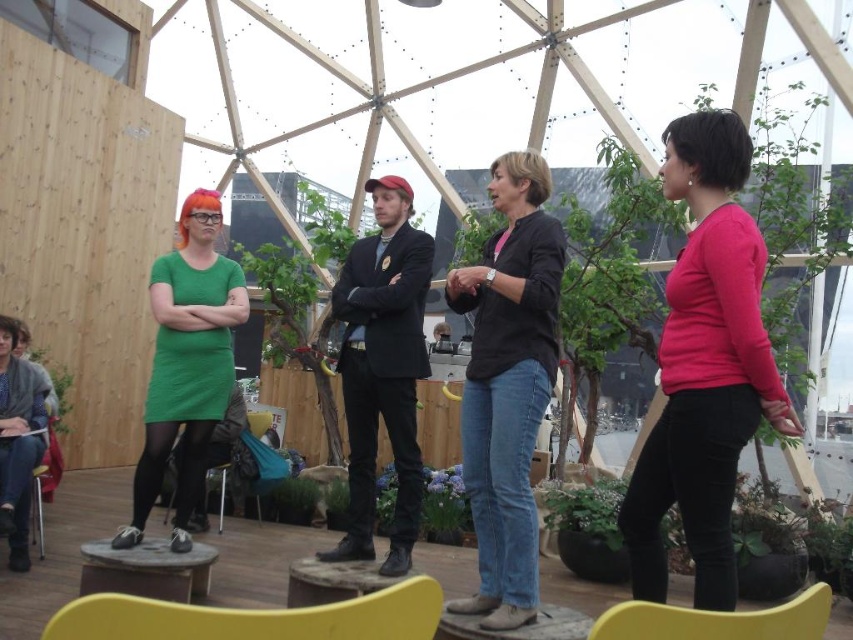
Question: Can you confirm if denim jeans at center is positioned to the left of yellow plastic chair at lower center?

Choices:
 (A) no
 (B) yes

Answer: (A)

Question: Which of the following is the closest to the observer?

Choices:
 (A) green matte dress at center
 (B) green fabric dress at lower left
 (C) black suit at center

Answer: (A)

Question: Can you confirm if matte yellow chair at lower center is positioned above green fabric dress at lower left?

Choices:
 (A) yes
 (B) no

Answer: (B)

Question: Is matte pink sweater at right wider than green matte plant at lower left?

Choices:
 (A) yes
 (B) no

Answer: (A)

Question: Considering the real-world distances, which object is farthest from the black suit at center?

Choices:
 (A) green matte plant at lower left
 (B) matte yellow chair at lower center
 (C) purple matte plant at center
 (D) green matte dress at center

Answer: (B)

Question: Which object appears farthest from the camera in this image?

Choices:
 (A) metallic silver stool at lower left
 (B) green matte plant at lower left
 (C) green matte dress at center

Answer: (B)